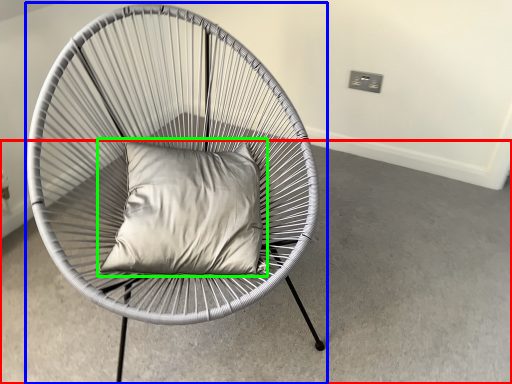
Question: Estimate the real-world distances between objects in this image. Which object is farther from concrete (highlighted by a red box), chair (highlighted by a blue box) or pillow (highlighted by a green box)?

Choices:
 (A) chair
 (B) pillow

Answer: (A)